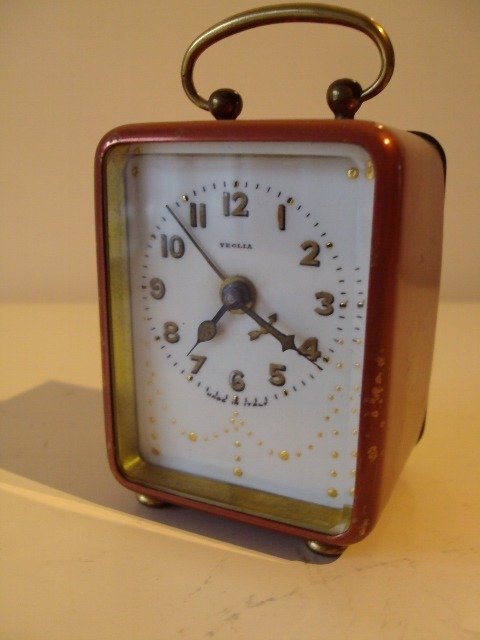
You are a GUI agent. You are given a task and a screenshot of the screen. Output one action in this format:
    pyautogui.click(x=<x>, y=<y>)
    Task: Click on the handle
    
    Given the screenshot: What is the action you would take?
    pyautogui.click(x=219, y=102), pyautogui.click(x=278, y=10), pyautogui.click(x=340, y=91)